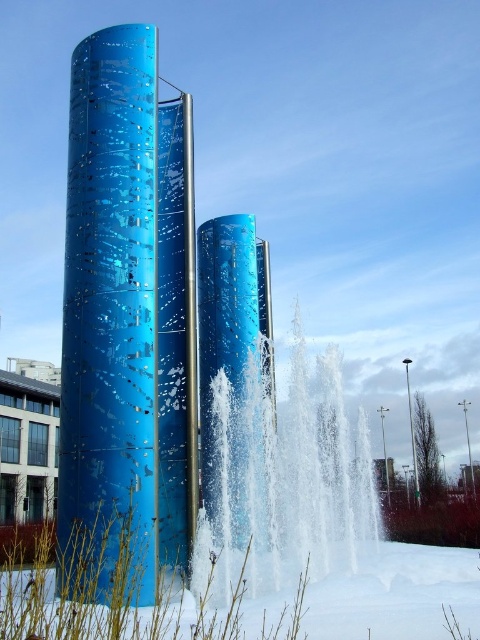
You are an architect analyzing the outdoor installation. You need to determine which of the two towers, the blue metallic tower at left or the glossy metallic tower at center, is taller. Based on the scene description, which one is taller?

The blue metallic tower at left is much taller than the glossy metallic tower at center.

You are a maintenance worker needing to reach both the clear water at center and the glossy metallic tower at center. If you can only move in a straight line from your current position, which object will you encounter first?

The clear water at center and glossy metallic tower at center are 1.44 meters apart. Since both objects are at the center, their positions are overlapping, so you will encounter both at the same time.

You are standing 50 feet away from the two blue cylinders in the image. Can you reach the point marked as point (x=113, y=116) without moving closer than your current distance?

The distance of point (x=113, y=116) from viewer is 51.22 feet, which is farther than your current position of 50 feet. Therefore, you cannot reach point (x=113, y=116) without moving closer.